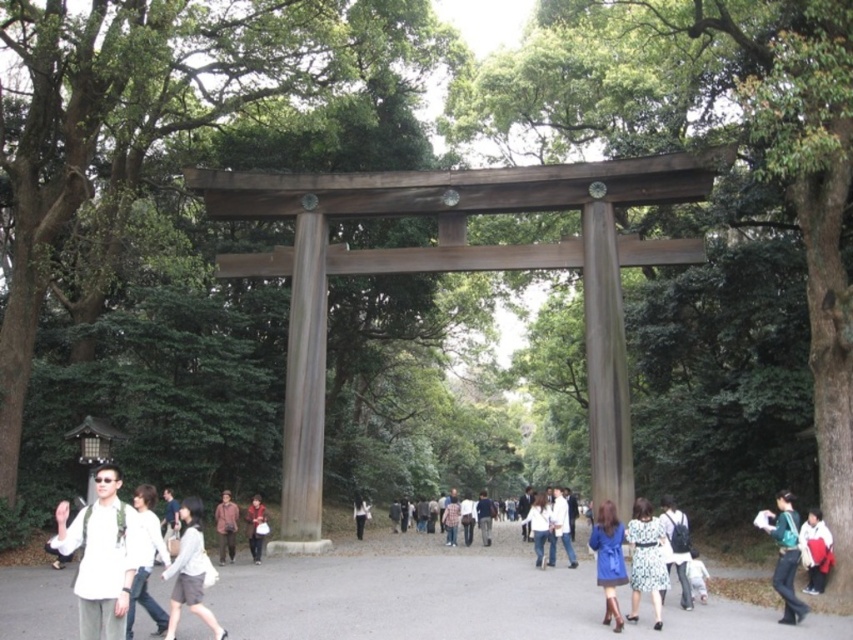
Between point (132, 609) and point (540, 541), which one is positioned in front?

Point (132, 609) is in front.

How distant is white cotton shirt at lower left from denim jacket at center?

74.61 feet

Is point (142, 506) farther from camera compared to point (544, 506)?

No.

What are the coordinates of `white cotton shirt at lower left` in the screenshot? It's located at click(146, 561).

Is white cotton shirt at lower left to the left of brown leather jacket at center from the viewer's perspective?

Indeed, white cotton shirt at lower left is positioned on the left side of brown leather jacket at center.

I want to click on white cotton shirt at lower left, so click(x=146, y=561).

Identify the location of white cotton shirt at lower left. (146, 561).

Does brown leather jacket at center appear over matte gray jacket at center?

Incorrect, brown leather jacket at center is not positioned above matte gray jacket at center.

Can you confirm if brown leather jacket at center is shorter than matte gray jacket at center?

No, brown leather jacket at center is not shorter than matte gray jacket at center.

Where is `brown leather jacket at center`? brown leather jacket at center is located at coordinates (225, 525).